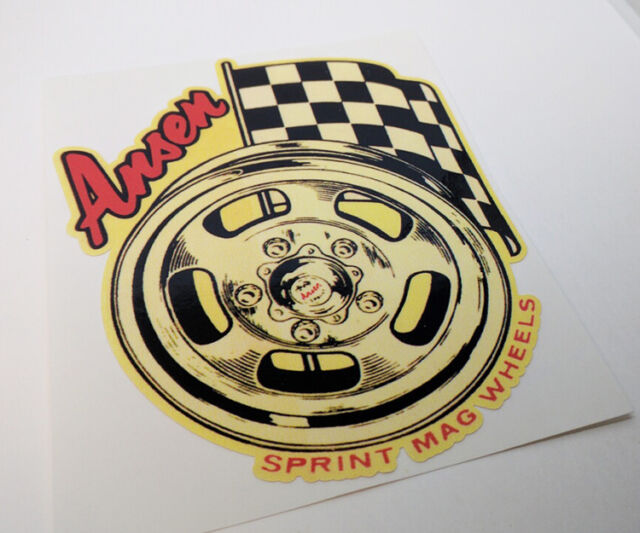
Find the location of `sticker`. sticker is located at coordinates (308, 361).